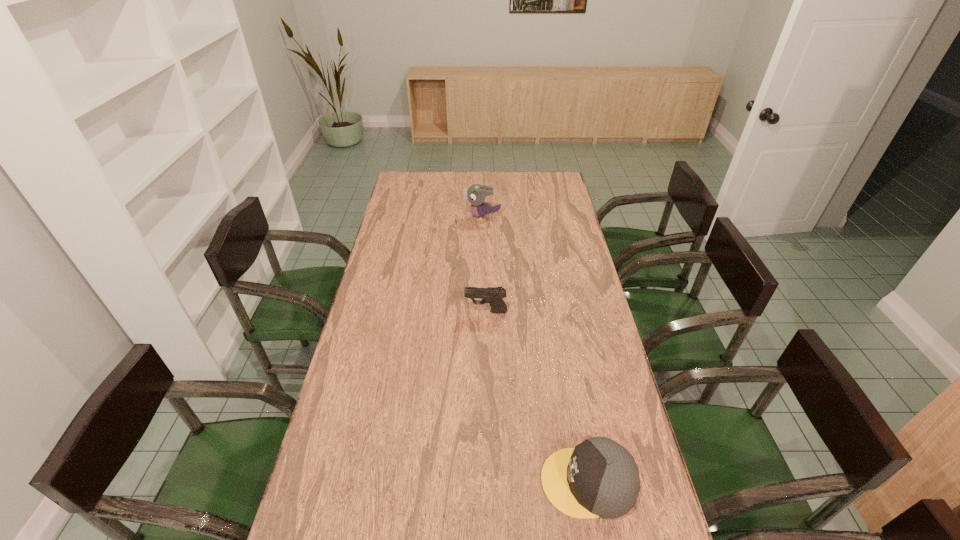
Find the location of a particular element. This screenshot has height=540, width=960. vacant region located at the barrel of the pistol is located at coordinates (367, 312).

At what (x,y) coordinates should I click in order to perform the action: click on vacant space located 0.380m on the front-facing side of the cap. Please return your answer as a coordinate pair (x, y). The image size is (960, 540). Looking at the image, I should click on (392, 482).

In order to click on vacant space located on the front-facing side of the cap in this screenshot , I will do `click(510, 482)`.

The image size is (960, 540). I want to click on vacant space situated 0.080m on the front-facing side of the cap, so click(510, 482).

Identify the location of object that is at the right edge. The width and height of the screenshot is (960, 540). (598, 478).

At what (x,y) coordinates should I click in order to perform the action: click on free location at the far edge. Please return your answer as a coordinate pair (x, y). This screenshot has width=960, height=540. Looking at the image, I should click on (490, 184).

Identify the location of vacant region at the left edge of the desktop. This screenshot has height=540, width=960. (357, 347).

This screenshot has height=540, width=960. What are the coordinates of `vacant space at the right edge of the desktop` in the screenshot? It's located at (545, 227).

Where is `vacant area between the pistol and the nearest object`? Image resolution: width=960 pixels, height=540 pixels. vacant area between the pistol and the nearest object is located at coordinates (537, 397).

Locate an element on the screen. free space between the cap and the second nearest object is located at coordinates (537, 397).